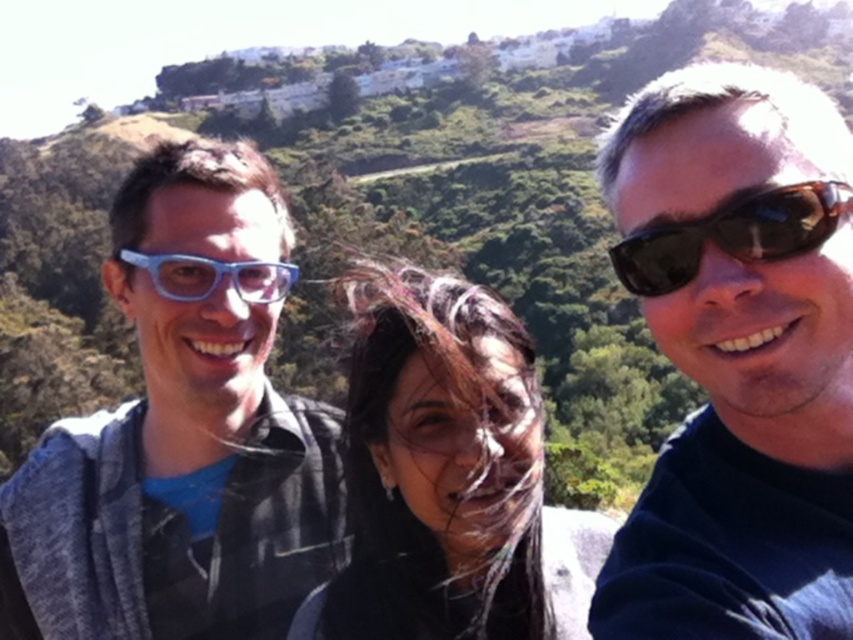
Question: Can you confirm if black plastic sunglasses at upper right is positioned above matte blue glasses at left?

Choices:
 (A) no
 (B) yes

Answer: (A)

Question: Which object appears closest to the camera in this image?

Choices:
 (A) brown textured sunglasses at right
 (B) blue plastic glasses at left

Answer: (A)

Question: Which of the following is the farthest from the observer?

Choices:
 (A) (180, 282)
 (B) (364, 611)
 (C) (195, 320)
 (D) (776, 248)

Answer: (A)

Question: Can you confirm if black plastic sunglasses at upper right is smaller than dark brown hair at center?

Choices:
 (A) no
 (B) yes

Answer: (B)

Question: Considering the relative positions of dark brown hair at center and brown textured sunglasses at right in the image provided, where is dark brown hair at center located with respect to brown textured sunglasses at right?

Choices:
 (A) below
 (B) above

Answer: (A)

Question: Which of these objects is positioned farthest from the dark brown hair at center?

Choices:
 (A) blue plastic glasses at left
 (B) black plastic sunglasses at upper right
 (C) brown textured sunglasses at right

Answer: (C)